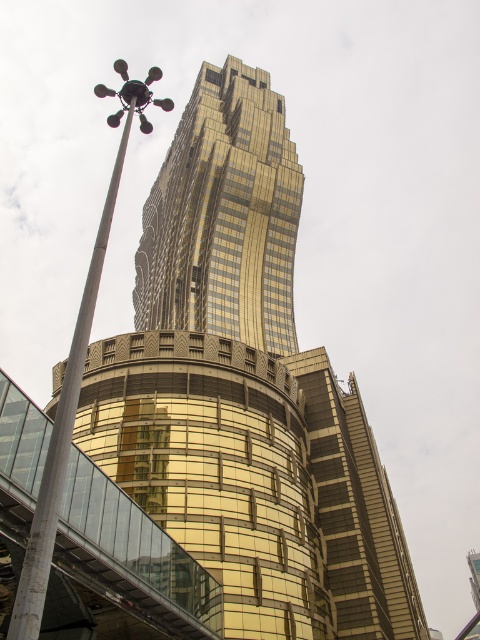
You are standing at the base of the skyscraper and want to take a photo of the point at coordinates (179,125). If the camera you are using has a focal length of 50mm and you are 153.78 meters away from the point, what is the approximate angle of view needed to capture the point in the frame?

The point at coordinates (179,125) is 153.78 meters away from the camera. To calculate the angle of view needed, use the formula angle of view in degrees equals arctangent of object distance divided by focal length. Plugging in the values, arctangent of 153.78 divided by 50 equals approximately 73 degrees. Therefore, an angle of view of about 73 degrees would be required to capture the point in the frame.